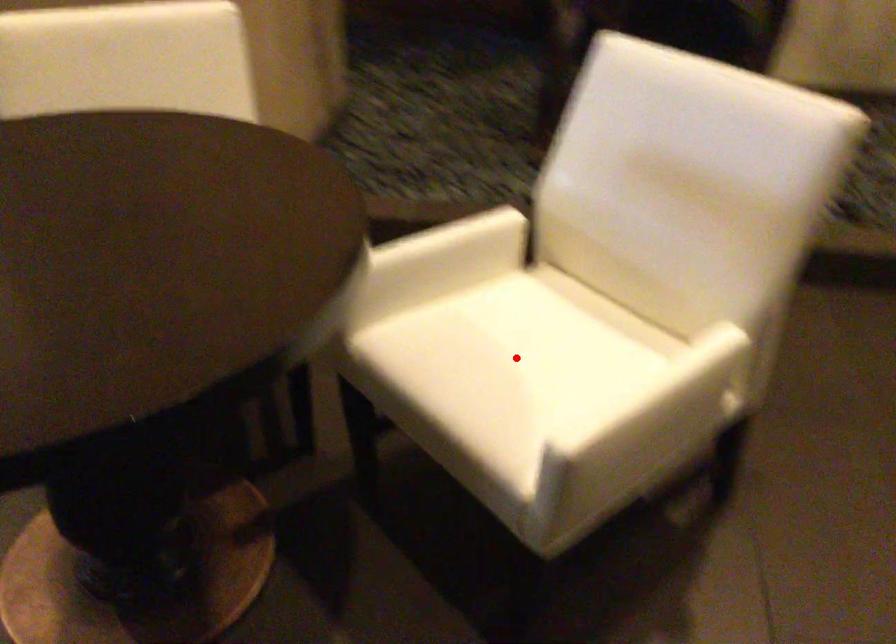
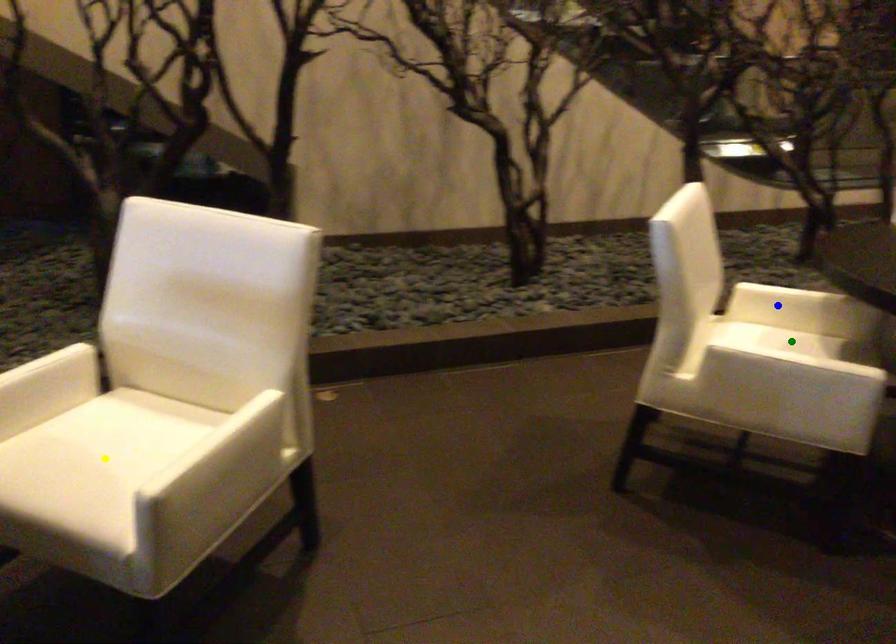
Question: I am providing you with two images of the same scene from different viewpoints. A red point is marked on the first image. You are given multiple points on the second image. Which point in image 2 represents the same 3d spot as the red point in image 1?

Choices:
 (A) blue point
 (B) yellow point
 (C) green point

Answer: (B)